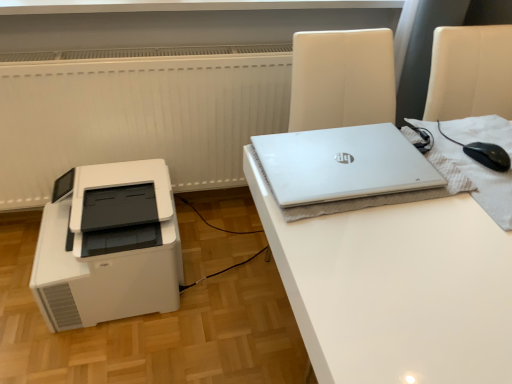
Where is `free point in front of white plastic printer at lower left`? Image resolution: width=512 pixels, height=384 pixels. free point in front of white plastic printer at lower left is located at coordinates (96, 352).